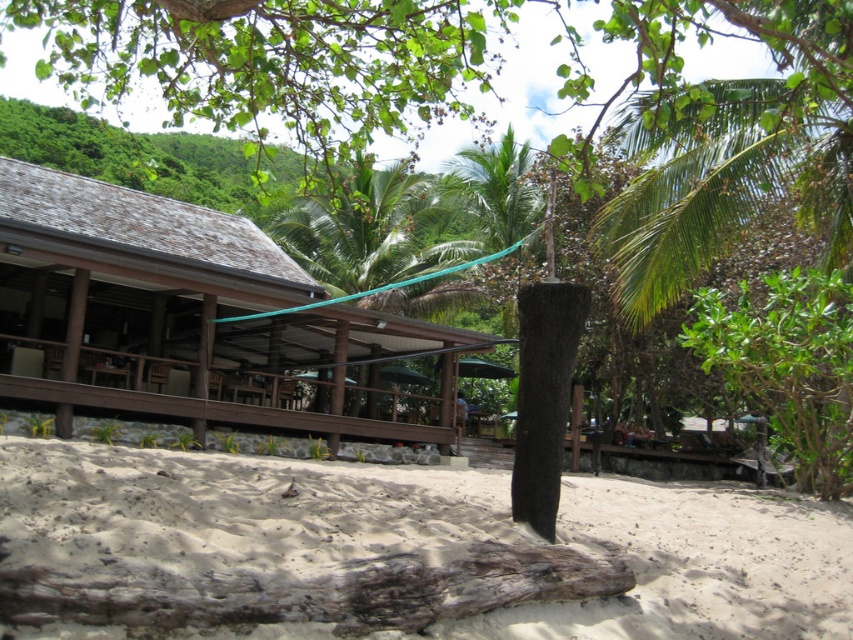
Question: Estimate the real-world distances between objects in this image. Which object is closer to the light brown sandy beach at center?

Choices:
 (A) brown wooden hut at center
 (B) green leafy palm tree at upper center

Answer: (A)

Question: Which point is farther to the camera?

Choices:
 (A) (808, 605)
 (B) (428, 212)

Answer: (B)

Question: Does brown wooden hut at center have a greater width compared to green leafy palm tree at upper center?

Choices:
 (A) no
 (B) yes

Answer: (B)

Question: Which of these objects is positioned farthest from the green leafy palm tree at upper center?

Choices:
 (A) brown wooden hut at center
 (B) light brown sandy beach at center

Answer: (B)

Question: Does light brown sandy beach at center lie behind green leafy palm tree at upper center?

Choices:
 (A) yes
 (B) no

Answer: (B)

Question: Considering the relative positions of brown wooden hut at center and green leafy palm tree at upper center in the image provided, where is brown wooden hut at center located with respect to green leafy palm tree at upper center?

Choices:
 (A) below
 (B) above

Answer: (A)